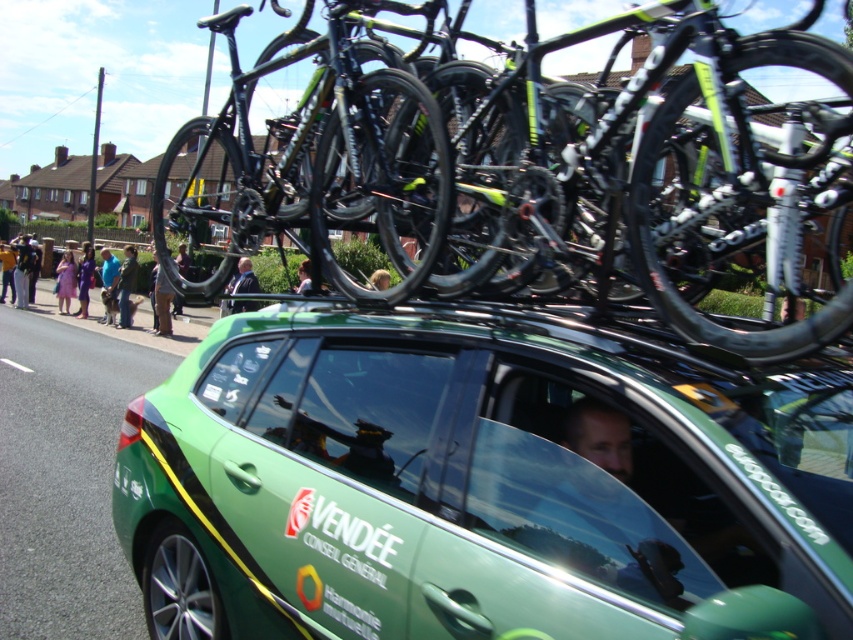
You are a photographer trying to capture a portrait of the smooth skin face at center while ensuring the blue denim jeans at lower left also appear in the frame. Given their sizes, which object should you focus on to ensure both are in focus?

The smooth skin face at center has a lesser width compared to blue denim jeans at lower left, so you should focus on the blue denim jeans at lower left to ensure both are in focus since it is larger and occupies more space in the frame.

From the picture: You are a pedestrian standing at the edge of the road. You see the green matte car at center and the blue denim jeans at lower left. Which object is closer to you?

The blue denim jeans at lower left is closer to you because the green matte car at center is positioned under it, meaning the jeans are above the car from your perspective.